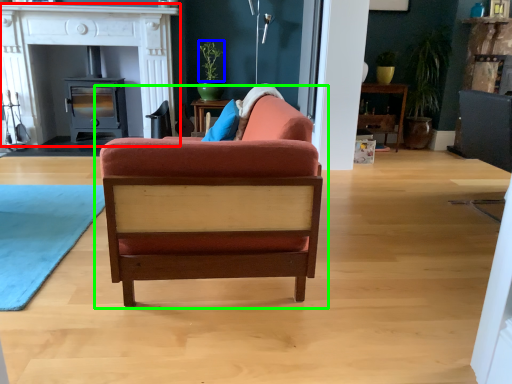
Question: Based on their relative distances, which object is nearer to fireplace (highlighted by a red box)? Choose from plant (highlighted by a blue box) and chair (highlighted by a green box).

Choices:
 (A) plant
 (B) chair

Answer: (A)